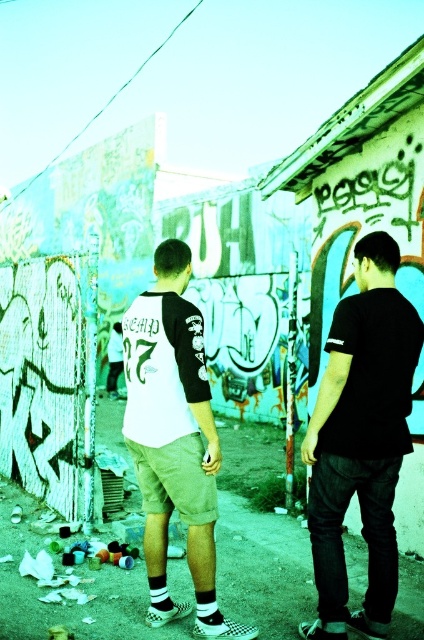
Question: Can you confirm if black matte shirt at center is positioned to the right of white cotton shorts at center?

Choices:
 (A) yes
 (B) no

Answer: (A)

Question: Is black matte shirt at center thinner than white cotton shorts at center?

Choices:
 (A) yes
 (B) no

Answer: (A)

Question: Which of the following is the farthest from the observer?

Choices:
 (A) (147, 465)
 (B) (325, 556)

Answer: (A)

Question: Which object appears farthest from the camera in this image?

Choices:
 (A) black matte shirt at center
 (B) white cotton shorts at center

Answer: (B)

Question: Is black matte shirt at center smaller than white cotton shorts at center?

Choices:
 (A) no
 (B) yes

Answer: (B)